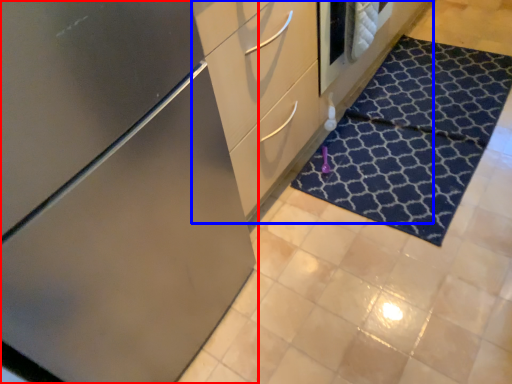
Question: Which object appears closest to the camera in this image, cabinetry (highlighted by a red box) or dresser (highlighted by a blue box)?

Choices:
 (A) cabinetry
 (B) dresser

Answer: (A)